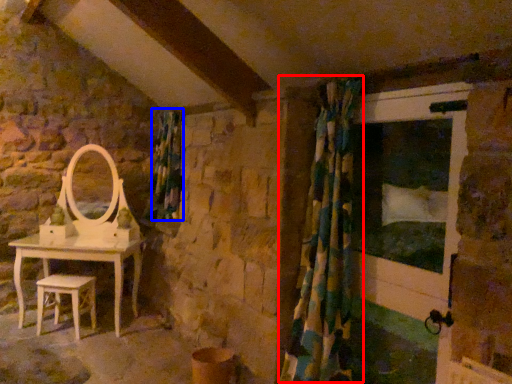
Question: Which object is closer to the camera taking this photo, shower curtain (highlighted by a red box) or curtain (highlighted by a blue box)?

Choices:
 (A) shower curtain
 (B) curtain

Answer: (A)